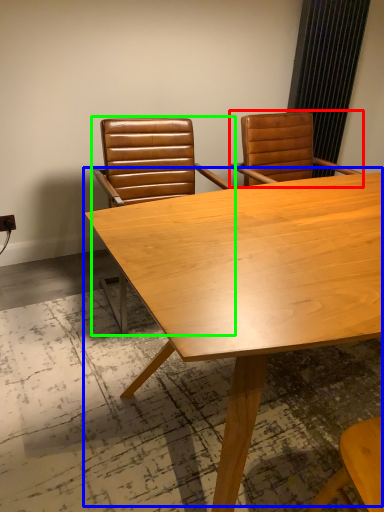
Question: Considering the real-world distances, which object is farthest from chair (highlighted by a red box)? table (highlighted by a blue box) or chair (highlighted by a green box)?

Choices:
 (A) table
 (B) chair

Answer: (A)